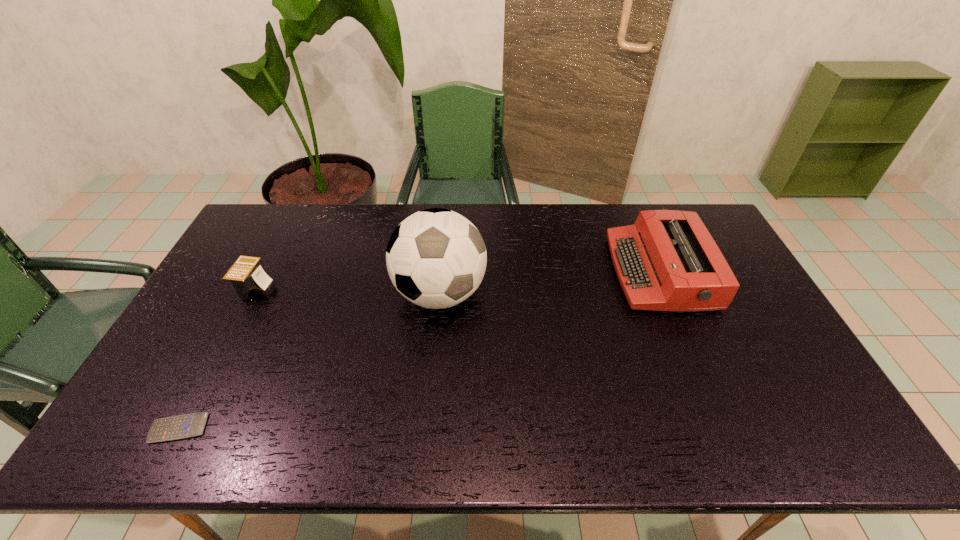
What are the coordinates of `the third object from left to right` in the screenshot? It's located at (436, 258).

This screenshot has height=540, width=960. Identify the location of the tallest object. (436, 258).

In order to click on typewriter in this screenshot , I will do `click(667, 260)`.

Locate an element on the screen. Image resolution: width=960 pixels, height=540 pixels. the rightmost object is located at coordinates (667, 260).

Locate an element on the screen. The width and height of the screenshot is (960, 540). the farther calculator is located at coordinates pos(250,282).

I want to click on the taller calculator, so click(250, 282).

Find the location of `the nearer calculator`. the nearer calculator is located at coordinates (184, 426).

At what (x,y) coordinates should I click in order to perform the action: click on the shortest object. Please return your answer as a coordinate pair (x, y). This screenshot has width=960, height=540. Looking at the image, I should click on (184, 426).

Locate an element on the screen. Image resolution: width=960 pixels, height=540 pixels. free space located on the main logo of the tallest object is located at coordinates 428,424.

At what (x,y) coordinates should I click in order to perform the action: click on vacant space located on the typing side of the typewriter. Please return your answer as a coordinate pair (x, y). Looking at the image, I should click on (515, 272).